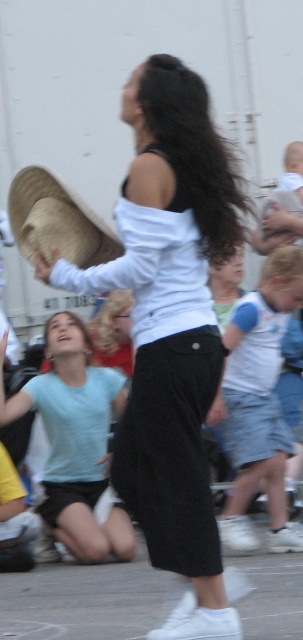
Question: Which object is the farthest from the denim skirt at lower right?

Choices:
 (A) brown straw hat at left
 (B) white matte shirt at center

Answer: (A)

Question: Which of these objects is positioned closest to the white matte shirt at center?

Choices:
 (A) light blue t-shirt at lower left
 (B) brown straw hat at left
 (C) denim skirt at lower right

Answer: (B)

Question: Is light blue t-shirt at lower left closer to camera compared to denim skirt at lower right?

Choices:
 (A) yes
 (B) no

Answer: (B)

Question: Is light blue t-shirt at lower left below brown straw hat at left?

Choices:
 (A) no
 (B) yes

Answer: (B)

Question: Which of the following is the closest to the observer?

Choices:
 (A) white matte shirt at center
 (B) brown straw hat at left
 (C) light blue t-shirt at lower left

Answer: (A)

Question: Can you confirm if white matte shirt at center is thinner than light blue t-shirt at lower left?

Choices:
 (A) no
 (B) yes

Answer: (A)